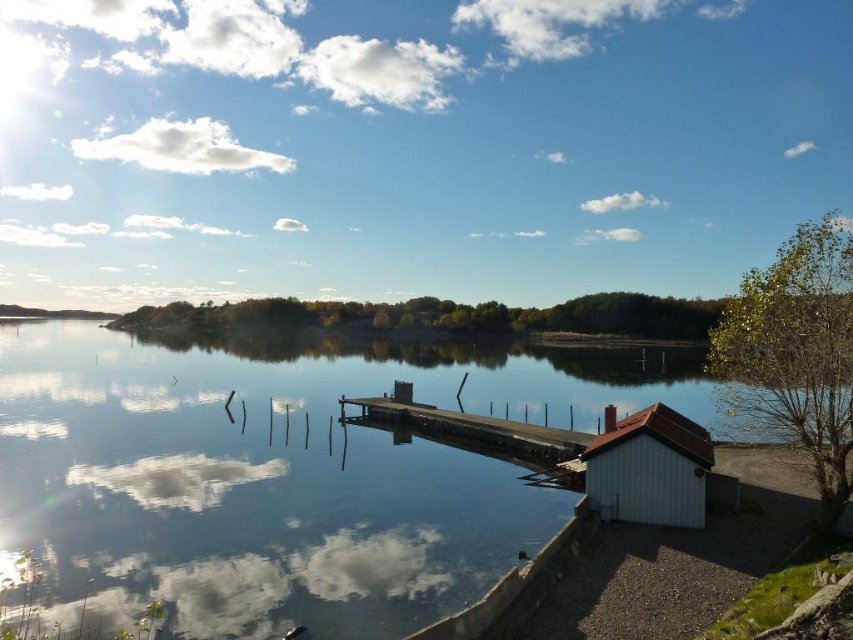
This screenshot has width=853, height=640. What are the coordinates of `transparent glass water at center` in the screenshot? It's located at (282, 476).

Which is more to the right, transparent glass water at center or white wood hut at lower right?

white wood hut at lower right is more to the right.

The image size is (853, 640). What are the coordinates of `transparent glass water at center` in the screenshot? It's located at (282, 476).

Can you confirm if white wood hut at lower right is positioned to the left of wooden dock at center?

Incorrect, white wood hut at lower right is not on the left side of wooden dock at center.

Is white wood hut at lower right below wooden dock at center?

Actually, white wood hut at lower right is above wooden dock at center.

What are the coordinates of `white wood hut at lower right` in the screenshot? It's located at (650, 468).

Find the location of a particular element. Image resolution: width=853 pixels, height=640 pixels. white wood hut at lower right is located at coordinates (650, 468).

Which is behind, point (381, 502) or point (474, 438)?

The point (474, 438) is behind.

Where is `transparent glass water at center`? The height and width of the screenshot is (640, 853). transparent glass water at center is located at coordinates (282, 476).